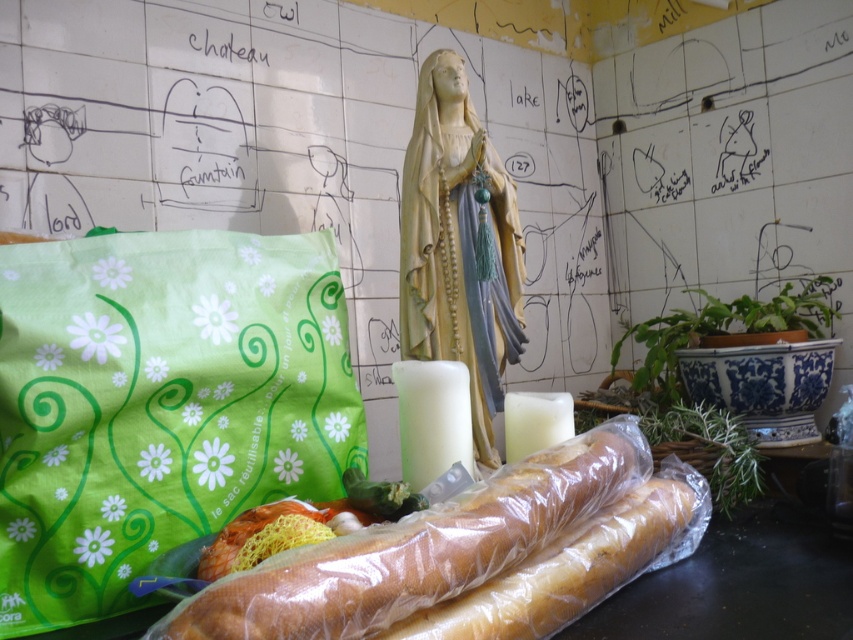
Question: Which object is closer to the camera taking this photo?

Choices:
 (A) white wax candle at center
 (B) black paper at upper center

Answer: (A)

Question: Does green fabric bag at lower left appear over golden brown baguette at center?

Choices:
 (A) yes
 (B) no

Answer: (A)

Question: From the image, what is the correct spatial relationship of white wax candle at center in relation to black paper at upper center?

Choices:
 (A) below
 (B) above

Answer: (A)

Question: Estimate the real-world distances between objects in this image. Which object is farther from the translucent plastic bag at center?

Choices:
 (A) translucent plastic baguette at center
 (B) black paper at upper center
 (C) golden brown baguette at center
 (D) green fabric bag at lower left

Answer: (B)

Question: Does translucent plastic bag at center lie in front of white wax candle at center?

Choices:
 (A) no
 (B) yes

Answer: (B)

Question: Which object is positioned farthest from the green fabric bag at lower left?

Choices:
 (A) black paper at upper center
 (B) translucent plastic bag at center
 (C) matte beige statue at center

Answer: (A)